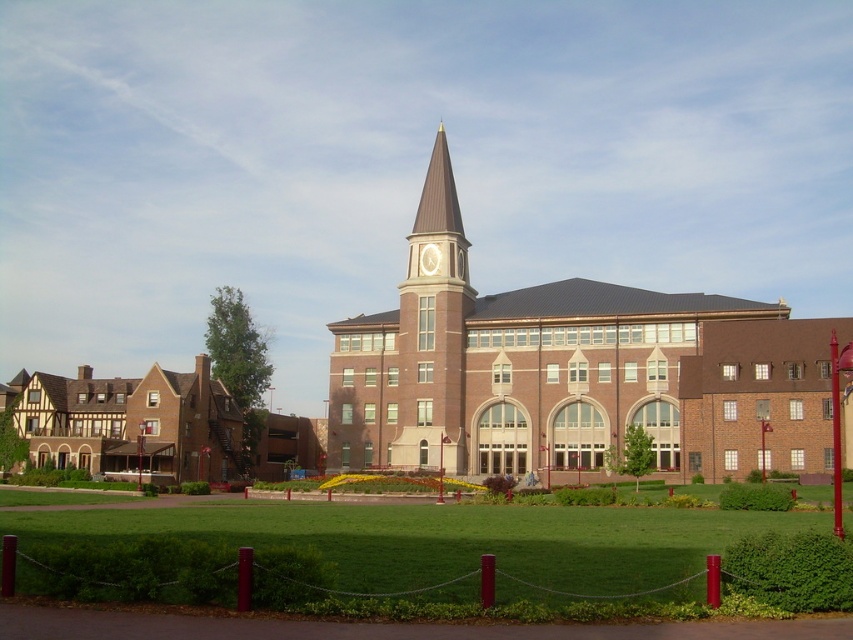
Question: Which point is farther to the camera?

Choices:
 (A) (415, 230)
 (B) (36, 586)

Answer: (A)

Question: Among these points, which one is farthest from the camera?

Choices:
 (A) (619, 595)
 (B) (445, 442)

Answer: (B)

Question: Can you confirm if green grass at center is positioned to the left of brown tudor-style house at left?

Choices:
 (A) yes
 (B) no

Answer: (B)

Question: Is brown brick church at center positioned before green grass at center?

Choices:
 (A) no
 (B) yes

Answer: (A)

Question: Is brown brick church at center closer to the viewer compared to green grass at center?

Choices:
 (A) yes
 (B) no

Answer: (B)

Question: Which of the following is the farthest from the observer?

Choices:
 (A) brown brick clock tower at center
 (B) green grass at center

Answer: (A)